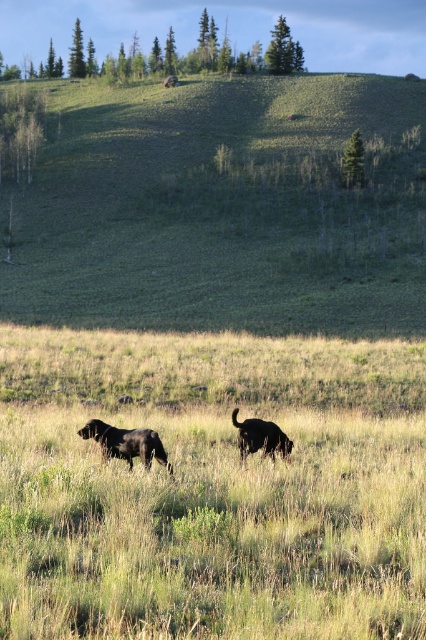
You are standing in the grassy field and want to walk to the green grassy hillside at center. Which direction should you head relative to the black matte dog at center?

The green grassy hillside at center is to the left of the black matte dog at center, so you should head to the left of the black matte dog at center to reach it.